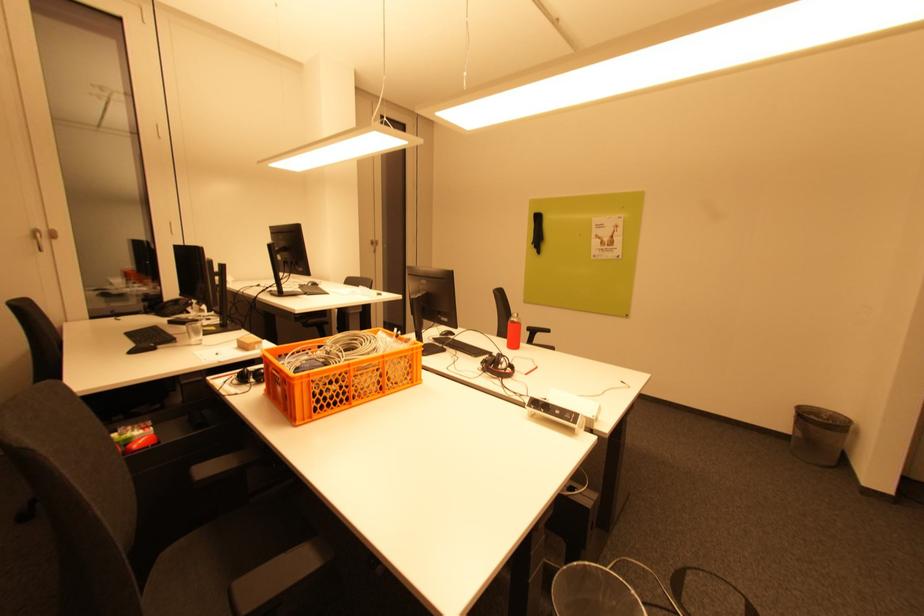
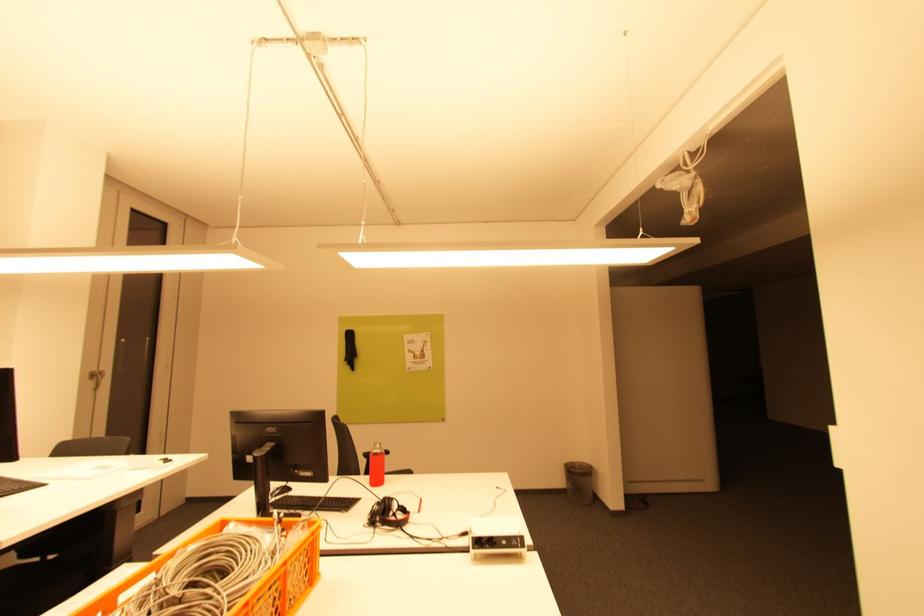
Question: The first image is from the beginning of the video and the second image is from the end. How did the camera likely rotate when shooting the video?

Choices:
 (A) Left
 (B) Right
 (C) Up
 (D) Down

Answer: (B)